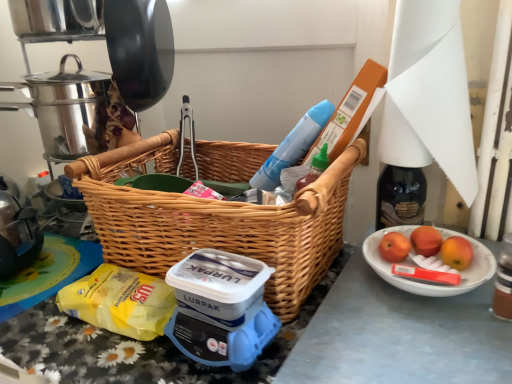
Question: In terms of width, does yellow plastic bag at lower left look wider or thinner when compared to white ceramic bowl at lower right?

Choices:
 (A) wide
 (B) thin

Answer: (B)

Question: From a real-world perspective, is yellow plastic bag at lower left above or below white ceramic bowl at lower right?

Choices:
 (A) below
 (B) above

Answer: (A)

Question: Which of these objects is positioned farthest from the woven wood picnic basket at center?

Choices:
 (A) yellow plastic bag at lower left
 (B) red matte apple at right, the first apple positioned from the left
 (C) red matte apple at right, the second apple in the right-to-left sequence
 (D) white paper at upper right
 (E) red matte apple at right, positioned as the first apple in right-to-left order

Answer: (E)

Question: Which object is positioned closest to the white paper at upper right?

Choices:
 (A) white ceramic bowl at lower right
 (B) yellow plastic bag at lower left
 (C) red matte apple at right, positioned as the first apple in right-to-left order
 (D) woven wood picnic basket at center
 (E) red matte apple at right, the first apple positioned from the left

Answer: (A)